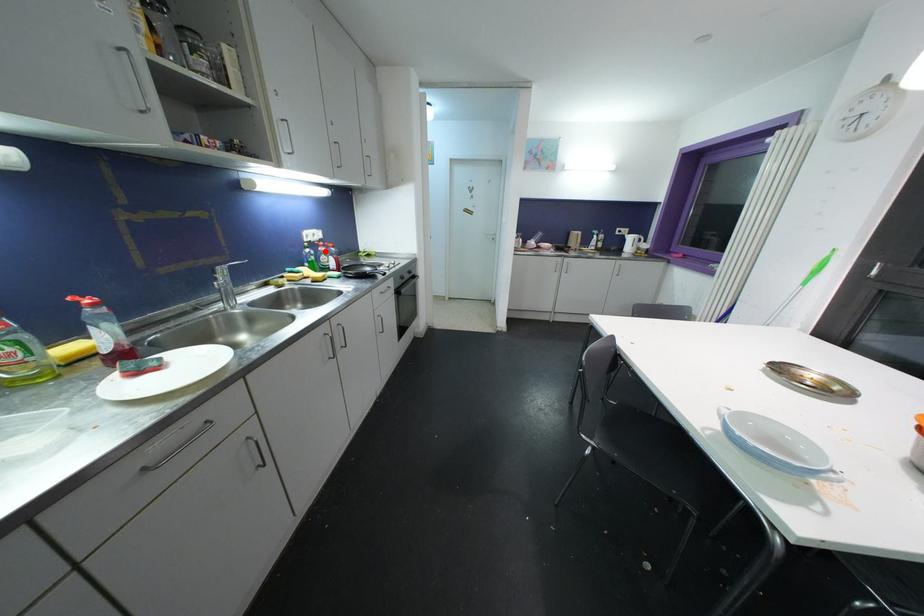
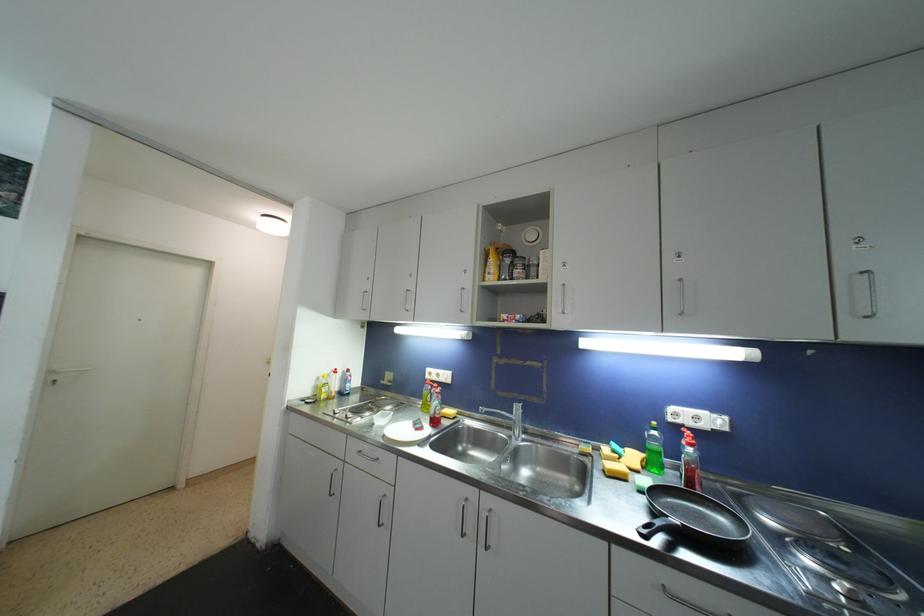
Question: I am providing you with two images of the same scene from different viewpoints. Given a red point in image1, look at the same physical point in image2. Is it:

Choices:
 (A) Closer to the viewpoint
 (B) Farther from the viewpoint

Answer: (B)